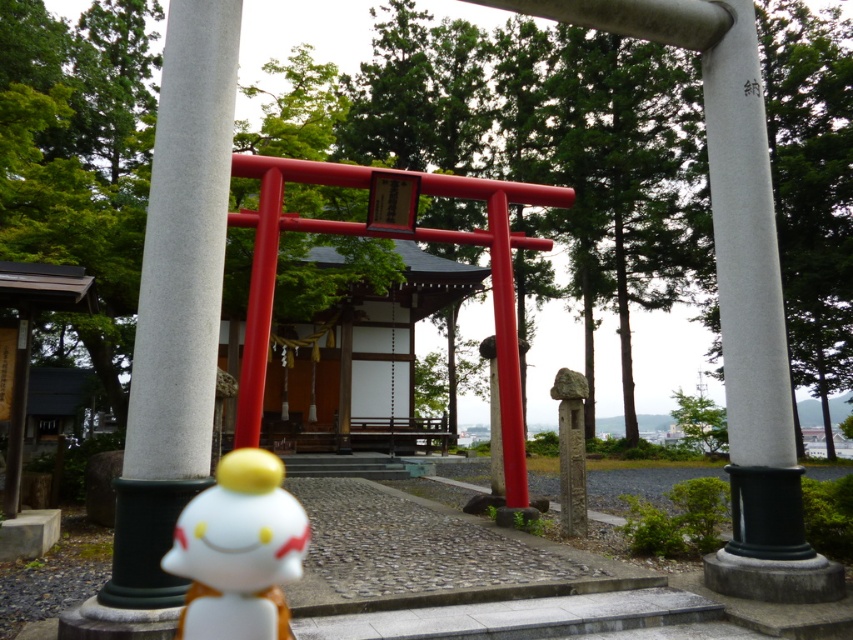
Who is taller, smooth gray stone pillar at center or white glossy figurine at lower center?

With more height is smooth gray stone pillar at center.

Is smooth gray stone pillar at center taller than white glossy figurine at lower center?

Yes, smooth gray stone pillar at center is taller than white glossy figurine at lower center.

Locate an element on the screen. smooth gray stone pillar at center is located at coordinates (177, 301).